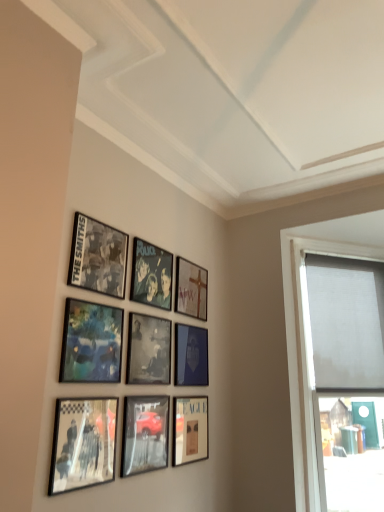
This screenshot has width=384, height=512. Describe the element at coordinates (191, 289) in the screenshot. I see `matte wooden picture frame at upper center, marked as the seventh picture frame in a bottom-to-top arrangement` at that location.

This screenshot has height=512, width=384. What do you see at coordinates (91, 343) in the screenshot?
I see `matte blue painting at center-left, the 6th picture frame ordered from the bottom` at bounding box center [91, 343].

Find the location of `matte blue painting at center-left, the 6th picture frame ordered from the bottom`. matte blue painting at center-left, the 6th picture frame ordered from the bottom is located at coordinates (91, 343).

What do you see at coordinates (148, 350) in the screenshot? The width and height of the screenshot is (384, 512). I see `black matte picture frame at center, acting as the fifth picture frame starting from the top` at bounding box center [148, 350].

The image size is (384, 512). What do you see at coordinates (191, 356) in the screenshot?
I see `matte black picture frame at center, the sixth picture frame in the top-to-bottom sequence` at bounding box center [191, 356].

This screenshot has width=384, height=512. What do you see at coordinates (346, 321) in the screenshot?
I see `white matte window screen at right` at bounding box center [346, 321].

Locate an element on the screen. This screenshot has width=384, height=512. matte black picture frame at lower center, marked as the first picture frame in a bottom-to-top arrangement is located at coordinates (190, 430).

Locate an element on the screen. This screenshot has height=512, width=384. matte wooden picture frame at upper center, marked as the seventh picture frame in a bottom-to-top arrangement is located at coordinates 191,289.

Between black matte picture frame at center, acting as the fifth picture frame starting from the top, and white matte window screen at right, which one has less height?

Standing shorter between the two is black matte picture frame at center, acting as the fifth picture frame starting from the top.

Is black matte picture frame at center, acting as the fifth picture frame starting from the top, in front of or behind white matte window screen at right in the image?

black matte picture frame at center, acting as the fifth picture frame starting from the top, is positioned closer to the viewer than white matte window screen at right.

Measure the distance between black matte picture frame at center, the 5th picture frame from the bottom, and white matte window screen at right.

They are 1.40 meters apart.

Is black matte picture frame at center, the 5th picture frame from the bottom, not inside white matte window screen at right?

black matte picture frame at center, the 5th picture frame from the bottom, is positioned outside white matte window screen at right.

Is matte black picture frame at upper left, the first picture frame when ordered from top to bottom, shorter than white matte window screen at right?

Yes, matte black picture frame at upper left, the first picture frame when ordered from top to bottom, is shorter than white matte window screen at right.

Is matte black picture frame at upper left, the first picture frame when ordered from top to bottom, thinner than white matte window screen at right?

Correct, the width of matte black picture frame at upper left, the first picture frame when ordered from top to bottom, is less than that of white matte window screen at right.

Starting from the white matte window screen at right, which picture frame is the 7th one to the left? Please provide its 2D coordinates.

[(98, 257)]

Considering the positions of objects white matte window screen at right and metallic silver photo frame at center, which appears as the 8th picture frame when ordered from the bottom, in the image provided, who is more to the left, white matte window screen at right or metallic silver photo frame at center, which appears as the 8th picture frame when ordered from the bottom,?

Positioned to the left is metallic silver photo frame at center, which appears as the 8th picture frame when ordered from the bottom.

From the image's perspective, who appears lower, white matte window screen at right or metallic silver photo frame at center, which appears as the second picture frame when viewed from the top?

white matte window screen at right appears lower in the image.

Does white matte window screen at right come in front of metallic silver photo frame at center, which appears as the 8th picture frame when ordered from the bottom?

No, white matte window screen at right is further to the viewer.

In the scene shown: From a real-world perspective, between matte wooden picture frame at upper center, which is the 3th picture frame in top-to-bottom order, and matte blue painting at center-left, the 4th picture frame positioned from the top, who is vertically higher?

matte wooden picture frame at upper center, which is the 3th picture frame in top-to-bottom order, from a real-world perspective.

Which of these two, matte wooden picture frame at upper center, marked as the seventh picture frame in a bottom-to-top arrangement, or matte blue painting at center-left, the 4th picture frame positioned from the top, stands shorter?

Standing shorter between the two is matte wooden picture frame at upper center, marked as the seventh picture frame in a bottom-to-top arrangement.

Could you tell me if matte wooden picture frame at upper center, marked as the seventh picture frame in a bottom-to-top arrangement, is facing matte blue painting at center-left, the 4th picture frame positioned from the top?

No, matte wooden picture frame at upper center, marked as the seventh picture frame in a bottom-to-top arrangement, is not aimed at matte blue painting at center-left, the 4th picture frame positioned from the top.

The height and width of the screenshot is (512, 384). I want to click on the 7th picture frame to the left of the matte wooden picture frame at upper center, which is the 3th picture frame in top-to-bottom order, counting from the anchor's position, so click(91, 343).

From the image's perspective, is matte wooden picture frame at upper center, marked as the seventh picture frame in a bottom-to-top arrangement, under metallic reflective car at lower center, acting as the 8th picture frame starting from the top?

No, from the image's perspective, matte wooden picture frame at upper center, marked as the seventh picture frame in a bottom-to-top arrangement, is not beneath metallic reflective car at lower center, acting as the 8th picture frame starting from the top.

Considering the sizes of matte wooden picture frame at upper center, marked as the seventh picture frame in a bottom-to-top arrangement, and metallic reflective car at lower center, the 2th picture frame from the bottom, in the image, is matte wooden picture frame at upper center, marked as the seventh picture frame in a bottom-to-top arrangement, bigger or smaller than metallic reflective car at lower center, the 2th picture frame from the bottom,?

Clearly, matte wooden picture frame at upper center, marked as the seventh picture frame in a bottom-to-top arrangement, is smaller in size than metallic reflective car at lower center, the 2th picture frame from the bottom.

In the scene shown: Considering the sizes of objects matte wooden picture frame at upper center, marked as the seventh picture frame in a bottom-to-top arrangement, and metallic reflective car at lower center, acting as the 8th picture frame starting from the top, in the image provided, who is wider, matte wooden picture frame at upper center, marked as the seventh picture frame in a bottom-to-top arrangement, or metallic reflective car at lower center, acting as the 8th picture frame starting from the top,?

metallic reflective car at lower center, acting as the 8th picture frame starting from the top, is wider.

Is matte black picture frame at upper left, the first picture frame when ordered from top to bottom, not close to metallic silver photo frame at center, which appears as the 8th picture frame when ordered from the bottom?

No.

Is matte black picture frame at upper left, which ranks as the 9th picture frame in bottom-to-top order, aimed at metallic silver photo frame at center, which appears as the second picture frame when viewed from the top?

No.

How much distance is there between matte black picture frame at upper left, the first picture frame when ordered from top to bottom, and metallic silver photo frame at center, which appears as the 8th picture frame when ordered from the bottom?

They are 8.76 inches apart.

Which of these two, metallic silver photo frame at center, which appears as the 8th picture frame when ordered from the bottom, or metallic reflective photo frame at lower left, which is the third picture frame from bottom to top, is wider?

Wider between the two is metallic reflective photo frame at lower left, which is the third picture frame from bottom to top.

Measure the distance between metallic silver photo frame at center, which appears as the 8th picture frame when ordered from the bottom, and metallic reflective photo frame at lower left, acting as the 7th picture frame starting from the top.

26.08 inches.

How different are the orientations of metallic silver photo frame at center, which appears as the second picture frame when viewed from the top, and metallic reflective photo frame at lower left, acting as the 7th picture frame starting from the top, in degrees?

0.0089 degrees.

Based on their positions, is metallic silver photo frame at center, which appears as the 8th picture frame when ordered from the bottom, located to the left or right of metallic reflective photo frame at lower left, which is the third picture frame from bottom to top?

metallic silver photo frame at center, which appears as the 8th picture frame when ordered from the bottom, is positioned on metallic reflective photo frame at lower left, which is the third picture frame from bottom to top,'s right side.

Identify the location of picture frame that is the 5th object located in front of the white matte window screen at right. (148, 350).

From a real-world perspective, starting from the white matte window screen at right, which picture frame is the 1st one vertically above it? Please provide its 2D coordinates.

[(98, 257)]

Based on their spatial positions, is white matte window screen at right or metallic reflective photo frame at lower left, which is the third picture frame from bottom to top, closer to matte wooden picture frame at upper center, which is the 3th picture frame in top-to-bottom order?

Based on the image, metallic reflective photo frame at lower left, which is the third picture frame from bottom to top, appears to be nearer to matte wooden picture frame at upper center, which is the 3th picture frame in top-to-bottom order.

Looking at the image, which one is located closer to metallic reflective car at lower center, the 2th picture frame from the bottom, black matte picture frame at center, the 5th picture frame from the bottom, or white matte window screen at right?

Among the two, black matte picture frame at center, the 5th picture frame from the bottom, is located nearer to metallic reflective car at lower center, the 2th picture frame from the bottom.

Looking at this image, based on their spatial positions, is black matte picture frame at center, acting as the fifth picture frame starting from the top, or matte black picture frame at upper left, which ranks as the 9th picture frame in bottom-to-top order, closer to metallic silver photo frame at center, which appears as the 8th picture frame when ordered from the bottom?

The object closer to metallic silver photo frame at center, which appears as the 8th picture frame when ordered from the bottom, is matte black picture frame at upper left, which ranks as the 9th picture frame in bottom-to-top order.

Looking at the image, which one is located closer to metallic reflective photo frame at lower left, acting as the 7th picture frame starting from the top, matte black picture frame at center, the sixth picture frame in the top-to-bottom sequence, or matte wooden picture frame at upper center, marked as the seventh picture frame in a bottom-to-top arrangement?

The object closer to metallic reflective photo frame at lower left, acting as the 7th picture frame starting from the top, is matte black picture frame at center, the sixth picture frame in the top-to-bottom sequence.

Estimate the real-world distances between objects in this image. Which object is further from white matte window screen at right, metallic reflective photo frame at lower left, which is the third picture frame from bottom to top, or black matte picture frame at center, acting as the fifth picture frame starting from the top?

metallic reflective photo frame at lower left, which is the third picture frame from bottom to top, is positioned further to the anchor white matte window screen at right.

Based on their spatial positions, is metallic reflective car at lower center, the 2th picture frame from the bottom, or matte wooden picture frame at upper center, which is the 3th picture frame in top-to-bottom order, further from matte black picture frame at center, the sixth picture frame in the top-to-bottom sequence?

metallic reflective car at lower center, the 2th picture frame from the bottom, lies further to matte black picture frame at center, the sixth picture frame in the top-to-bottom sequence, than the other object.

From the image, which object appears to be nearer to white matte window screen at right, metallic reflective car at lower center, the 2th picture frame from the bottom, or matte black picture frame at center, the sixth picture frame in the top-to-bottom sequence?

matte black picture frame at center, the sixth picture frame in the top-to-bottom sequence, lies closer to white matte window screen at right than the other object.

When comparing their distances from matte wooden picture frame at upper center, marked as the seventh picture frame in a bottom-to-top arrangement, does black matte picture frame at center, the 5th picture frame from the bottom, or matte black picture frame at upper left, the first picture frame when ordered from top to bottom, seem closer?

Among the two, black matte picture frame at center, the 5th picture frame from the bottom, is located nearer to matte wooden picture frame at upper center, marked as the seventh picture frame in a bottom-to-top arrangement.

Image resolution: width=384 pixels, height=512 pixels. I want to click on picture frame between matte black picture frame at center, the sixth picture frame in the top-to-bottom sequence, and white matte window screen at right, so click(191, 289).